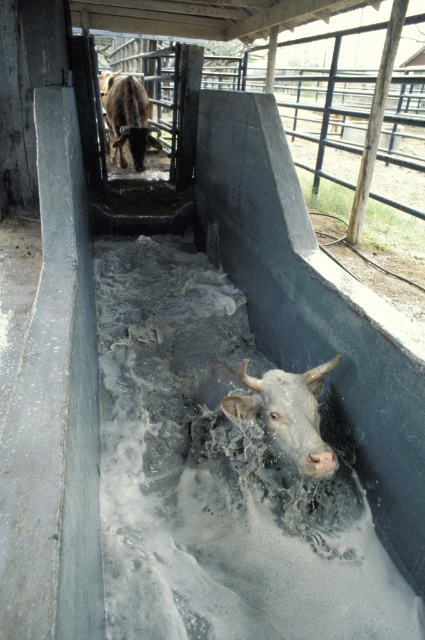
Does gray matte cow at center have a lesser width compared to brown glossy bull at upper center?

Yes, gray matte cow at center is thinner than brown glossy bull at upper center.

Can you confirm if gray matte cow at center is smaller than brown glossy bull at upper center?

Yes.

Which is in front, point (311, 438) or point (122, 93)?

Positioned in front is point (311, 438).

Where is `gray matte cow at center`? The height and width of the screenshot is (640, 425). gray matte cow at center is located at coordinates (286, 416).